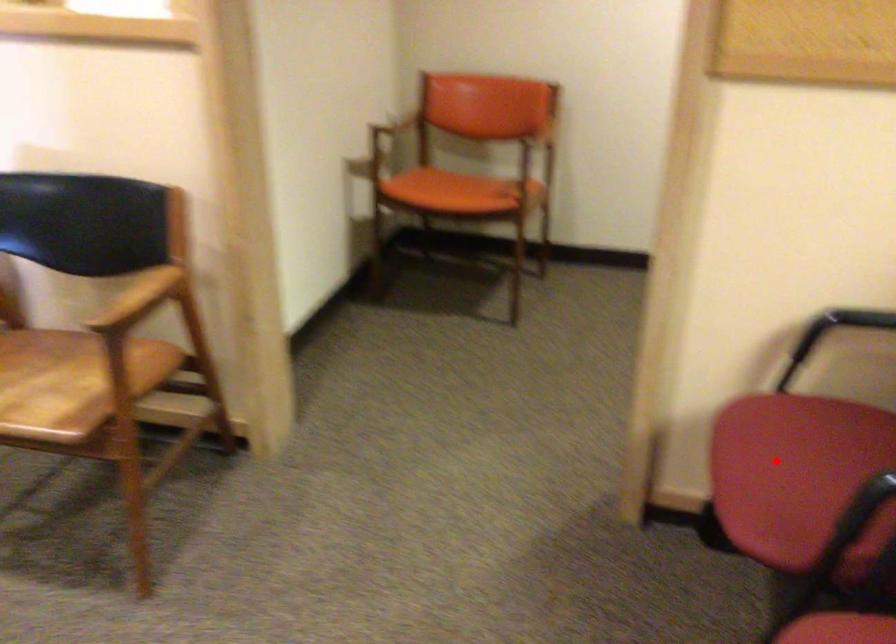
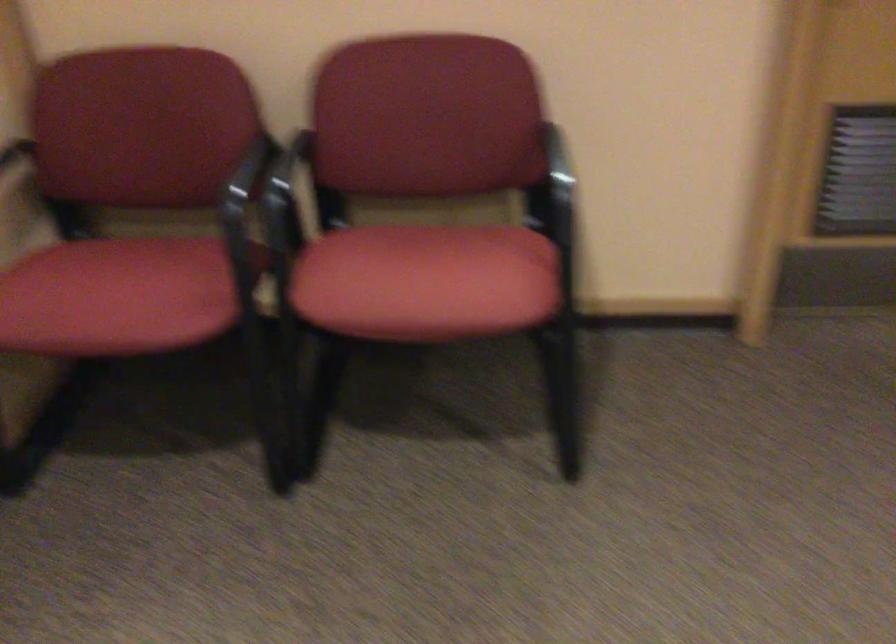
Locate, in the second image, the point that corresponds to the highlighted location in the first image.

(116, 297)